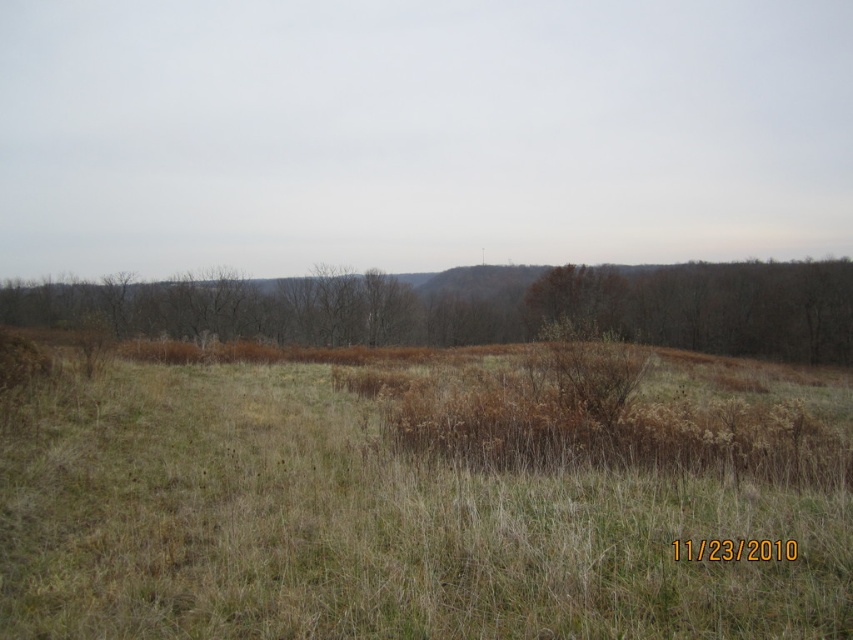
Based on the photo, you are a hiker trying to navigate through the dry grass at center and the brown textured shrub at center. Which one would you choose to walk over if you want to avoid stepping on something taller than your knees?

The dry grass at center has a lesser height compared to the brown textured shrub at center, so you should walk over the dry grass at center to avoid stepping on something taller than your knees.

You are a hiker trying to navigate through the dry grass at center and the brown textured shrub at center. Which direction should you go to avoid the shrub?

The dry grass at center is positioned on the right side of brown textured shrub at center, so you should go to the left to avoid the shrub.